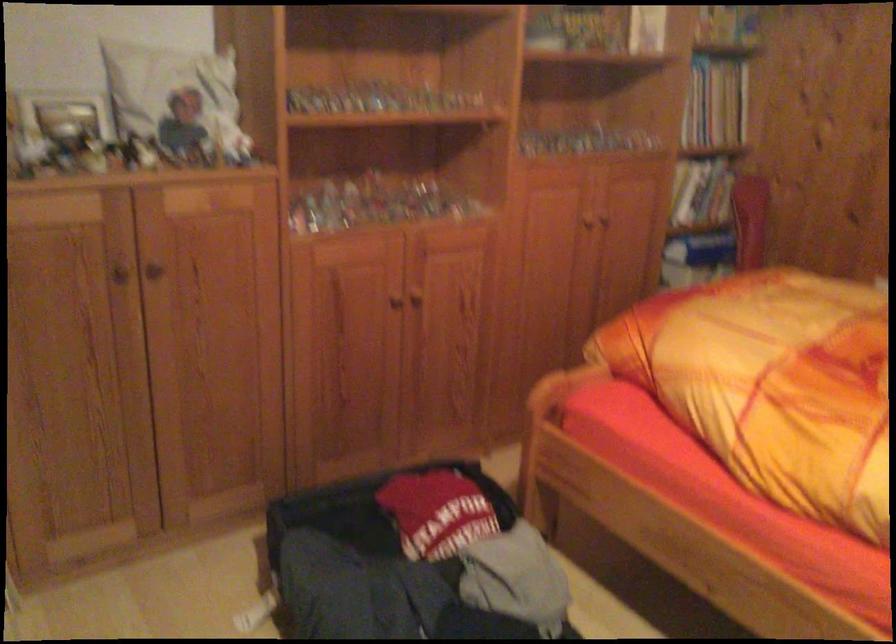
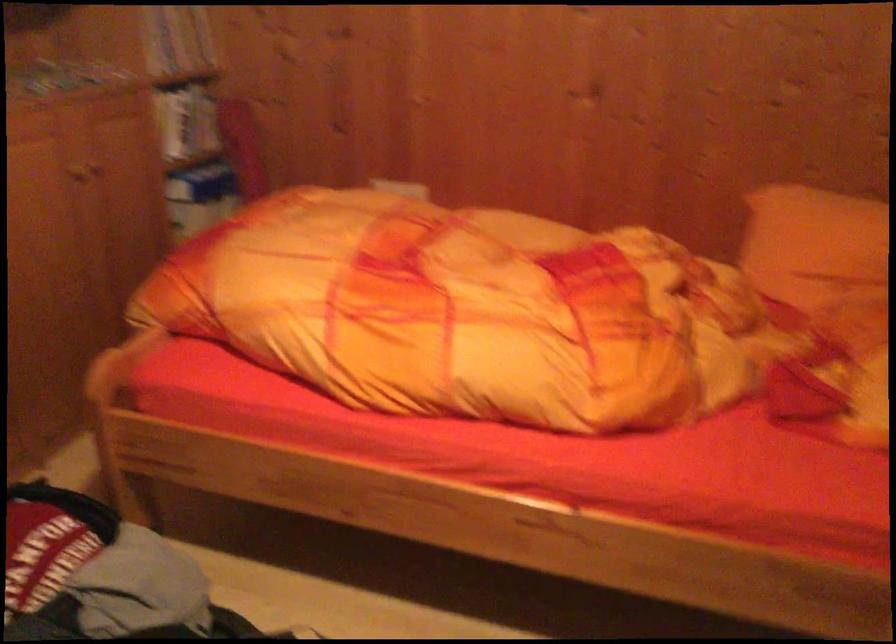
Question: The images are taken continuously from a first-person perspective. In which direction is your viewpoint rotating?

Choices:
 (A) Left
 (B) Right
 (C) Up
 (D) Down

Answer: (B)